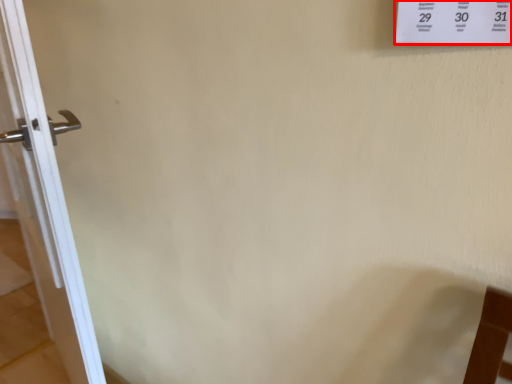
Question: Where is poster (annotated by the red box) located in relation to door in the image?

Choices:
 (A) right
 (B) left

Answer: (A)